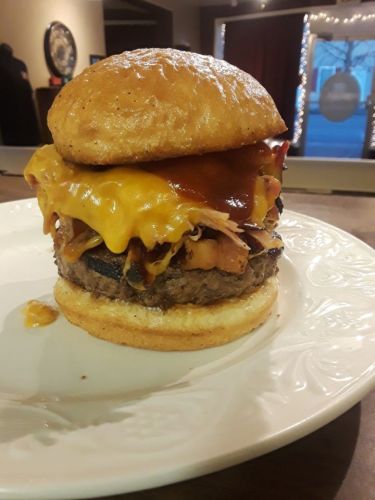
At what (x,y) coordinates should I click in order to perform the action: click on plate. Please return your answer as a coordinate pair (x, y). The image size is (375, 500). Looking at the image, I should click on (106, 426).